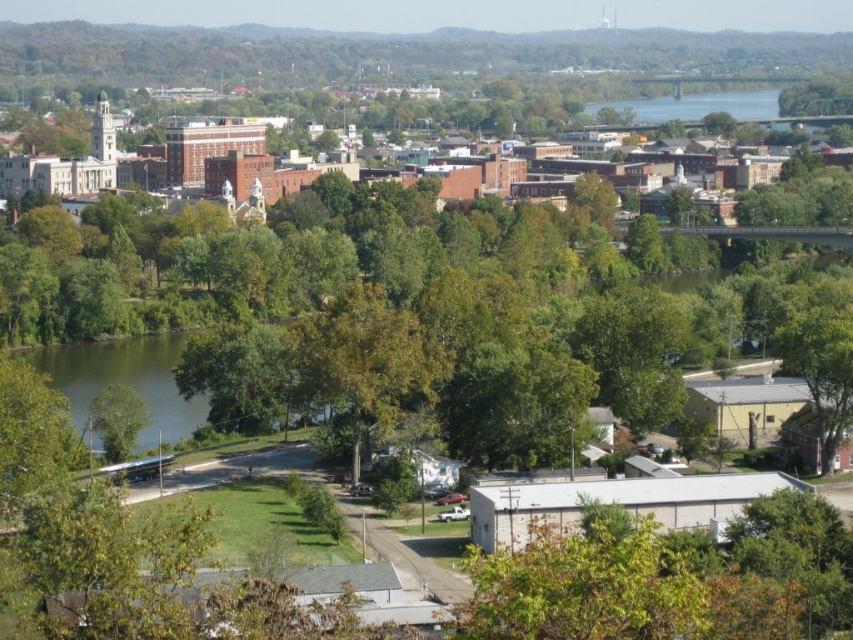
Question: Can you confirm if green leafy tree at center is positioned to the right of brick building at upper left?

Choices:
 (A) no
 (B) yes

Answer: (A)

Question: Does green leafy tree at center appear on the right side of green leafy tree at lower right?

Choices:
 (A) no
 (B) yes

Answer: (A)

Question: Which point appears closest to the camera in this image?

Choices:
 (A) (91, 173)
 (B) (819, 305)

Answer: (B)

Question: Does green leafy tree at center appear on the right side of green leafy tree at lower right?

Choices:
 (A) no
 (B) yes

Answer: (A)

Question: Based on their relative distances, which object is farther from the green leafy tree at lower left?

Choices:
 (A) brick building at upper left
 (B) green leafy tree at center
 (C) green leafy tree at lower right

Answer: (A)

Question: Which object is the closest to the brick building at upper left?

Choices:
 (A) green leafy tree at lower left
 (B) green leafy tree at center
 (C) green leafy tree at lower right

Answer: (C)